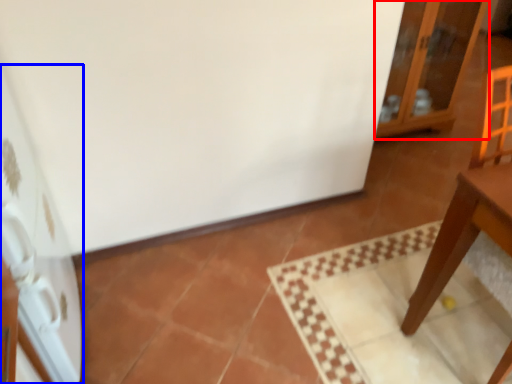
Question: Which of the following is the farthest to the observer, cabinetry (highlighted by a red box) or appliance (highlighted by a blue box)?

Choices:
 (A) cabinetry
 (B) appliance

Answer: (A)